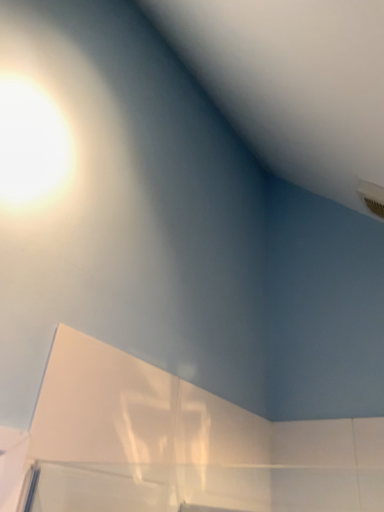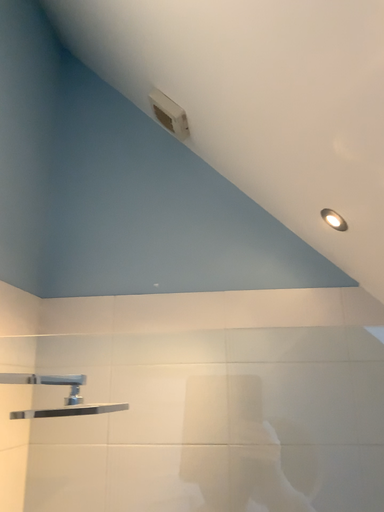
Question: How did the camera likely rotate when shooting the video?

Choices:
 (A) rotated upward
 (B) rotated downward

Answer: (B)